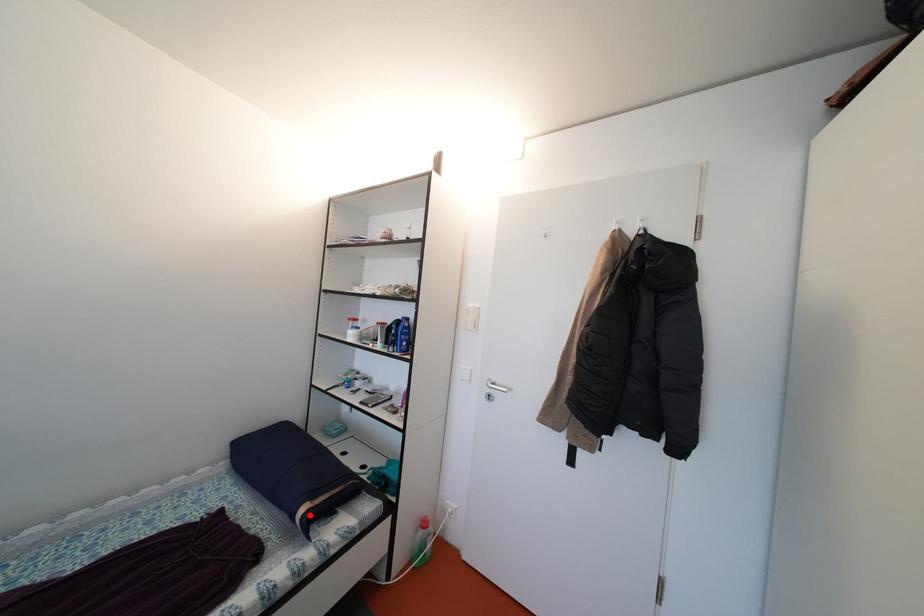
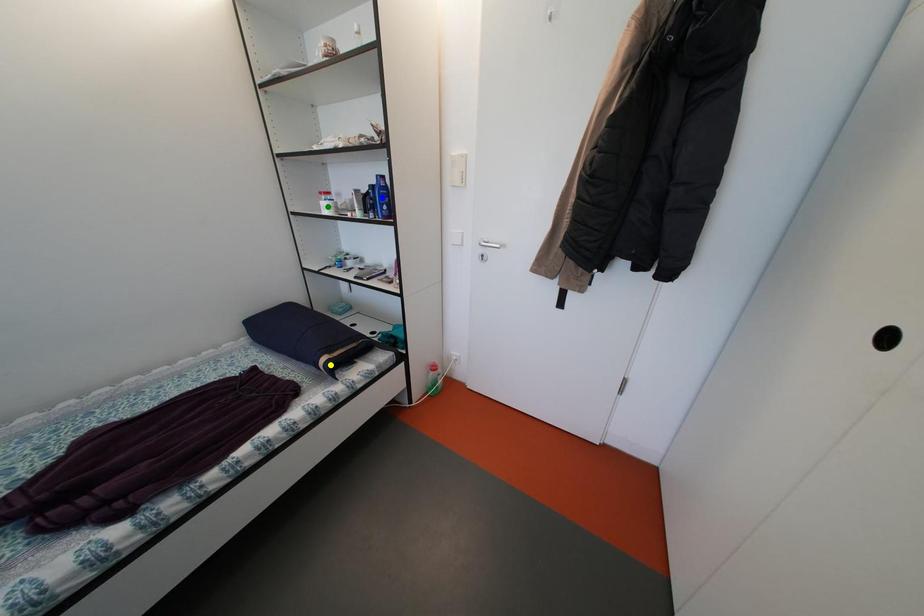
Question: I am providing you with two images of the same scene from different viewpoints. A red point is marked on the first image. You are given multiple points on the second image. In image 2, which mark is for the same physical point as the one in image 1?

Choices:
 (A) blue point
 (B) yellow point
 (C) green point

Answer: (B)